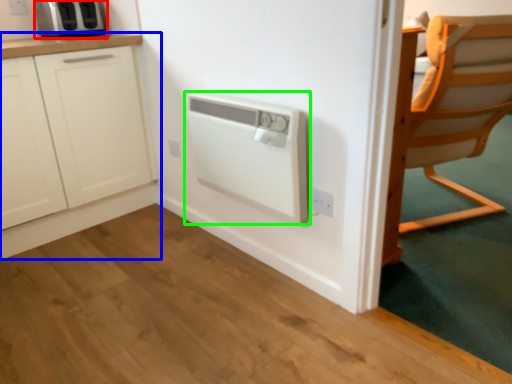
Question: Which object is positioned closest to kitchen appliance (highlighted by a red box)? Select from cabinetry (highlighted by a blue box) and home appliance (highlighted by a green box).

Choices:
 (A) cabinetry
 (B) home appliance

Answer: (A)